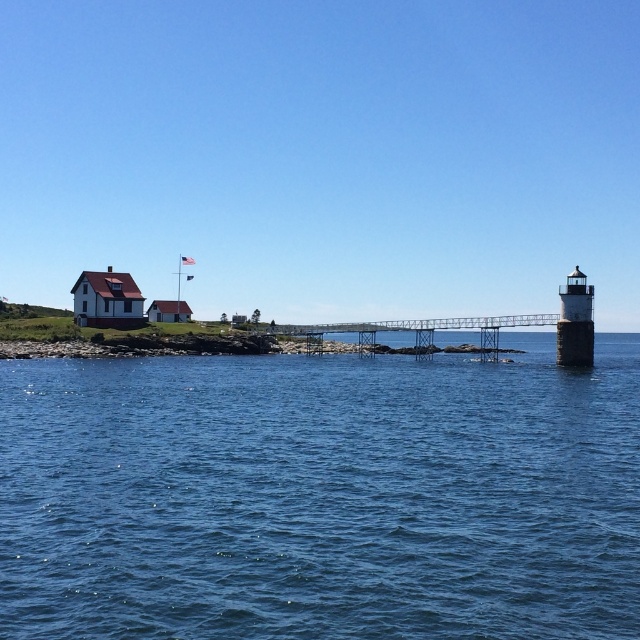
You are standing at point (321, 496) in the coastal scene. What do you see directly in front of you?

At point (321, 496) lies blue water at center.